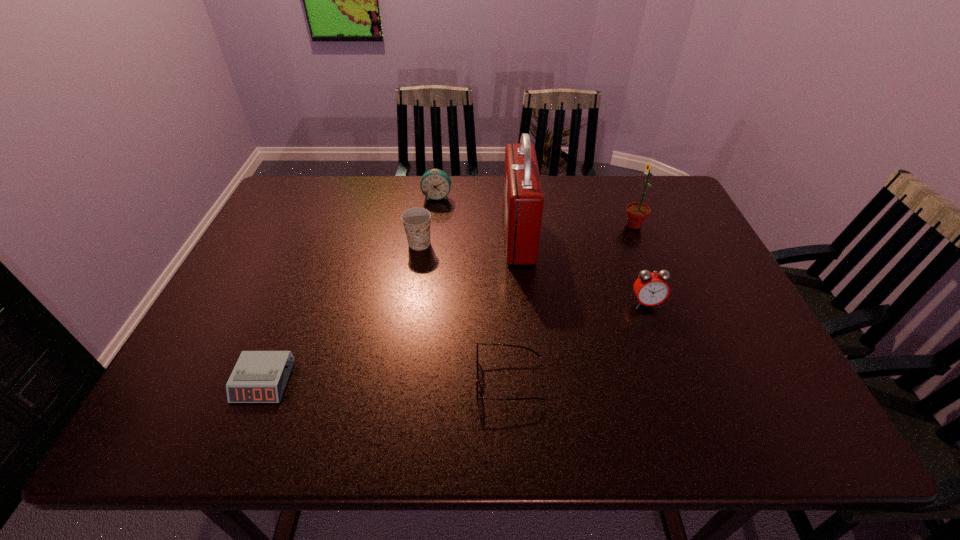
You are a GUI agent. You are given a task and a screenshot of the screen. Output one action in this format:
    pyautogui.click(x=<x>, y=<y>)
    Task: Click on the free space that is in between the leftmost object and the sixth tallest object
    
    Given the screenshot: What is the action you would take?
    pyautogui.click(x=387, y=381)

This screenshot has height=540, width=960. I want to click on free spot between the tallest object and the fifth farthest object, so click(x=582, y=269).

What are the coordinates of `free space between the Dixie cup and the nearest alarm clock` in the screenshot? It's located at (342, 313).

Identify the location of vacant space that's between the second tallest object and the first-aid kit. (576, 230).

Image resolution: width=960 pixels, height=540 pixels. I want to click on object that can be found as the fifth closest to the first-aid kit, so click(x=477, y=376).

This screenshot has width=960, height=540. I want to click on the second closest object to the first-aid kit, so click(x=416, y=221).

Identify the location of alarm clock that is the second nearest to the sixth tallest object. (259, 376).

Find the location of a particular element. The width and height of the screenshot is (960, 540). alarm clock that stands as the second closest to the Dixie cup is located at coordinates (259, 376).

At what (x,y) coordinates should I click in order to perform the action: click on vacant area in the image that satisfies the following two spatial constraints: 1. on the front-facing side of the rightmost alarm clock; 2. on the face of the second shortest object. Please return your answer as a coordinate pair (x, y). Looking at the image, I should click on (674, 380).